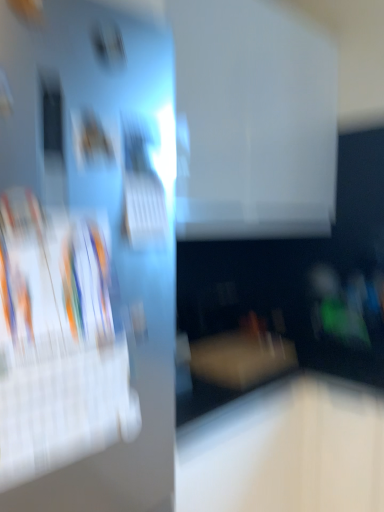
In order to face matte wood coffee table at center, should I rotate leftwards or rightwards?

Turn right by 6.522 degrees to look at matte wood coffee table at center.

At what (x,y) coordinates should I click in order to perform the action: click on matte wood coffee table at center. Please return your answer as a coordinate pair (x, y). This screenshot has width=384, height=512. Looking at the image, I should click on (241, 359).

What do you see at coordinates (241, 359) in the screenshot? This screenshot has width=384, height=512. I see `matte wood coffee table at center` at bounding box center [241, 359].

The width and height of the screenshot is (384, 512). What are the coordinates of `white glossy magazine at left` in the screenshot? It's located at (58, 341).

What do you see at coordinates (58, 341) in the screenshot?
I see `white glossy magazine at left` at bounding box center [58, 341].

I want to click on matte wood coffee table at center, so click(241, 359).

Which object is positioned more to the left, white glossy magazine at left or matte wood coffee table at center?

Positioned to the left is white glossy magazine at left.

Is white glossy magazine at left further to the viewer compared to matte wood coffee table at center?

No, the depth of white glossy magazine at left is less than that of matte wood coffee table at center.

Is point (118, 350) more distant than point (275, 364)?

No.

From the image's perspective, between white glossy magazine at left and matte wood coffee table at center, which one is located above?

From the image's view, white glossy magazine at left is above.

From a real-world perspective, is white glossy magazine at left physically located above or below matte wood coffee table at center?

From a real-world perspective, white glossy magazine at left is physically above matte wood coffee table at center.

Looking at their sizes, would you say white glossy magazine at left is wider or thinner than matte wood coffee table at center?

Clearly, white glossy magazine at left has less width compared to matte wood coffee table at center.

Which of these two, white glossy magazine at left or matte wood coffee table at center, stands taller?

white glossy magazine at left is taller.

Is white glossy magazine at left bigger than matte wood coffee table at center?

Yes.

Would you say white glossy magazine at left is outside matte wood coffee table at center?

white glossy magazine at left lies outside matte wood coffee table at center's area.

Is the surface of white glossy magazine at left in direct contact with matte wood coffee table at center?

No, white glossy magazine at left is not touching matte wood coffee table at center.

Based on the photo, is white glossy magazine at left facing away from matte wood coffee table at center?

That's not correct — white glossy magazine at left is not looking away from matte wood coffee table at center.

How different are the orientations of white glossy magazine at left and matte wood coffee table at center in degrees?

The angular difference between white glossy magazine at left and matte wood coffee table at center is 0.182 degrees.

Measure the distance from white glossy magazine at left to matte wood coffee table at center.

white glossy magazine at left and matte wood coffee table at center are 34.12 inches apart.

Identify the location of magazine above the matte wood coffee table at center (from a real-world perspective). (58, 341).

Considering the positions of objects matte wood coffee table at center and white glossy magazine at left in the image provided, who is more to the left, matte wood coffee table at center or white glossy magazine at left?

white glossy magazine at left is more to the left.

Between matte wood coffee table at center and white glossy magazine at left, which one is positioned behind?

matte wood coffee table at center.

Is point (256, 383) positioned after point (119, 355)?

Yes, it is behind point (119, 355).

From the image's perspective, does matte wood coffee table at center appear lower than white glossy magazine at left?

Correct, matte wood coffee table at center appears lower than white glossy magazine at left in the image.

From a real-world perspective, is matte wood coffee table at center under white glossy magazine at left?

Correct, in the physical world, matte wood coffee table at center is lower than white glossy magazine at left.

Looking at their sizes, would you say matte wood coffee table at center is wider or thinner than white glossy magazine at left?

Considering their sizes, matte wood coffee table at center looks broader than white glossy magazine at left.

Can you confirm if matte wood coffee table at center is taller than white glossy magazine at left?

No, matte wood coffee table at center is not taller than white glossy magazine at left.

Between matte wood coffee table at center and white glossy magazine at left, which one has smaller size?

matte wood coffee table at center.

Is matte wood coffee table at center situated inside white glossy magazine at left or outside?

matte wood coffee table at center is not inside white glossy magazine at left, it's outside.

Would you say matte wood coffee table at center is a long distance from white glossy magazine at left?

matte wood coffee table at center is near white glossy magazine at left, not far away.

Could you tell me if matte wood coffee table at center is facing white glossy magazine at left?

No, matte wood coffee table at center is not facing towards white glossy magazine at left.

Consider the image. How different are the orientations of matte wood coffee table at center and white glossy magazine at left in degrees?

The angle between the facing direction of matte wood coffee table at center and the facing direction of white glossy magazine at left is 0.182 degrees.

Measure the distance from matte wood coffee table at center to white glossy magazine at left.

They are 34.12 inches apart.

Where is `furniture below the white glossy magazine at left (from a real-world perspective)`? furniture below the white glossy magazine at left (from a real-world perspective) is located at coordinates (241, 359).

Locate an element on the screen. Image resolution: width=384 pixels, height=512 pixels. magazine in front of the matte wood coffee table at center is located at coordinates (58, 341).

Identify the location of furniture on the right of white glossy magazine at left. The height and width of the screenshot is (512, 384). (241, 359).